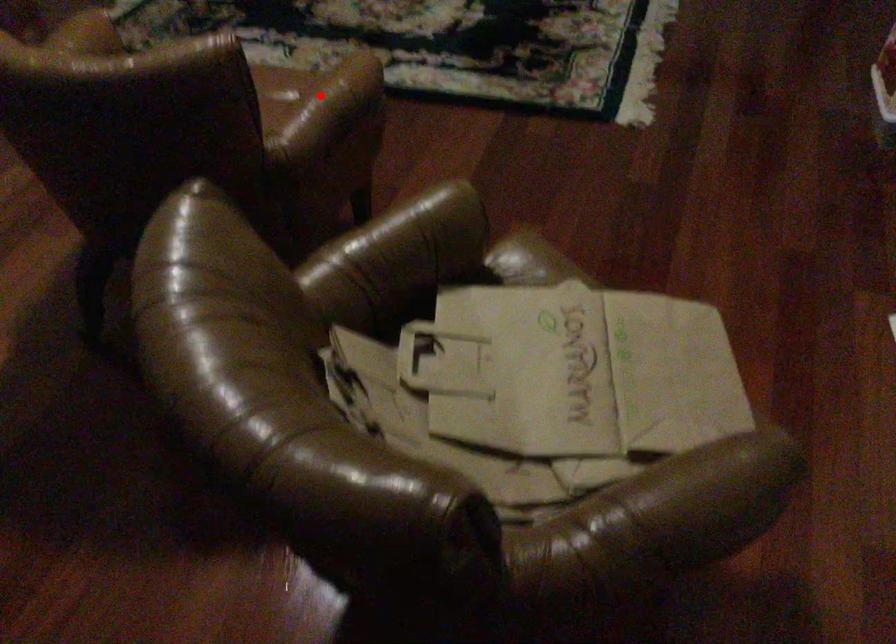
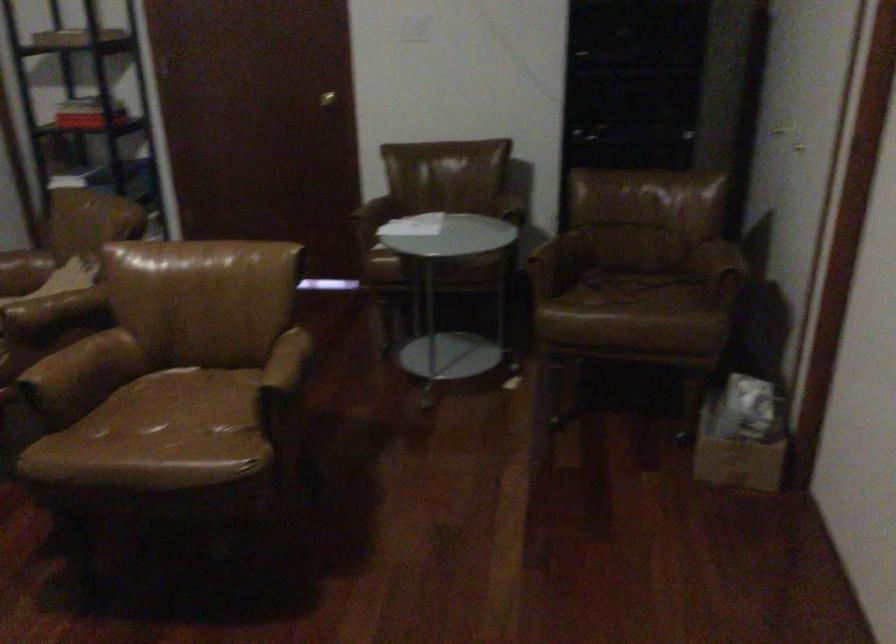
Question: A red point is marked in image1. In image2, is the corresponding 3D point closer to the camera or farther? Reply with the corresponding letter.

Choices:
 (A) The corresponding 3D point is closer.
 (B) The corresponding 3D point is farther.

Answer: (B)